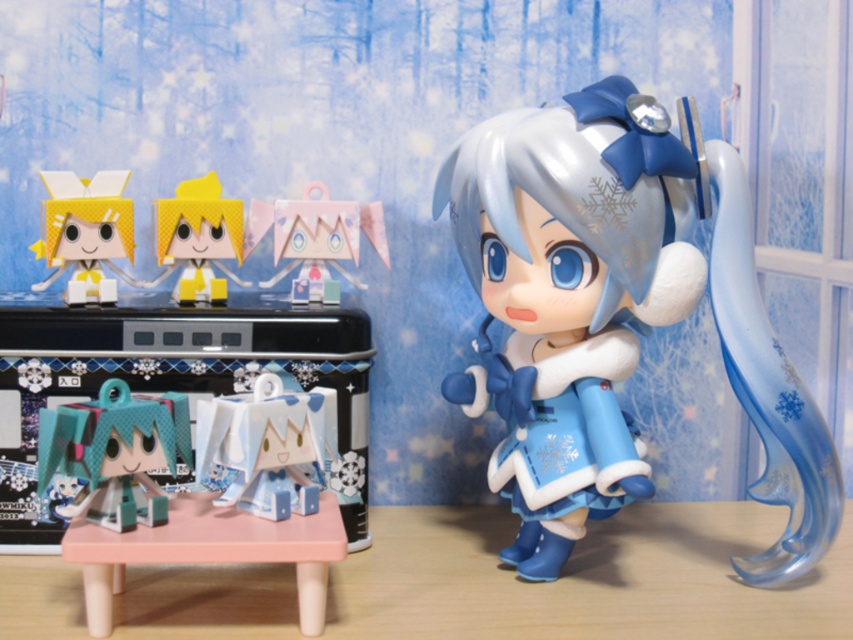
You are looking at the image of winter figurines arranged against a snowy backdrop. There are two points marked in the scene, point (613, 148) and point (229, 216). Which point is closer to you?

Point (613, 148) is closer to the viewer than point (229, 216).

You are a collector examining the figurines displayed against the snowy backdrop. You notice two points marked as point 1 at coordinates point (828,460) and point 2 at coordinates point (74,252). Which point is closer to you, the observer?

Point (828,460) is in front of point (74,252), so point (828,460) is closer to you.

You are organizing a display of winter figurines. You have a satin blue doll at right and a yellow matte toy at center. According to the scene, which figurine is positioned to the right of the other?

The satin blue doll at right is positioned to the right of the yellow matte toy at center.